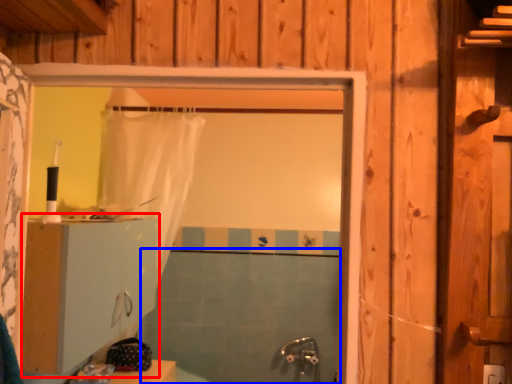
Question: Among these objects, which one is farthest to the camera, dresser (highlighted by a red box) or bath (highlighted by a blue box)?

Choices:
 (A) dresser
 (B) bath

Answer: (B)